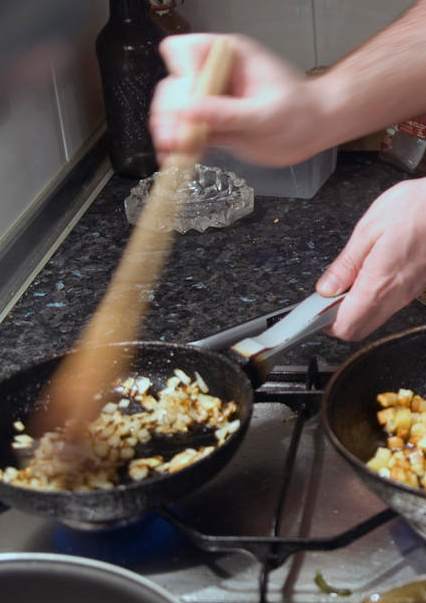
Locate an element on the screen. The height and width of the screenshot is (603, 426). this is where the frying pan handle is attached to the pan is located at coordinates (239, 365).